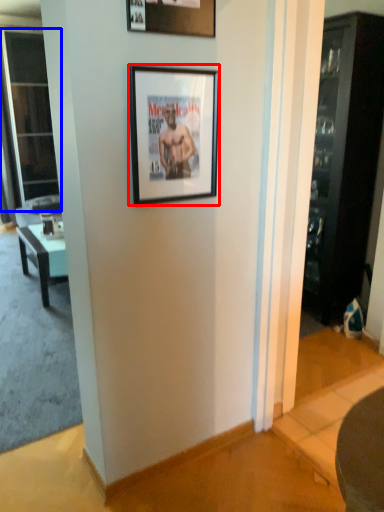
Question: Which of the following is the farthest to the observer, picture frame (highlighted by a red box) or screen door (highlighted by a blue box)?

Choices:
 (A) picture frame
 (B) screen door

Answer: (B)